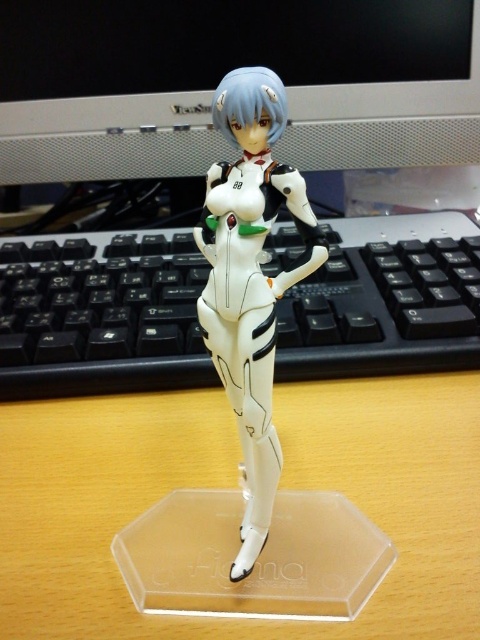
Find the location of a particular element. This screenshot has height=640, width=480. black plastic keyboard at center is located at coordinates (100, 314).

At what (x,y) coordinates should I click in order to perform the action: click on black plastic keyboard at center. Please return your answer as a coordinate pair (x, y). Image resolution: width=480 pixels, height=640 pixels. Looking at the image, I should click on (100, 314).

Is black plastic keyboard at center to the left of matte black monitor at upper center from the viewer's perspective?

Incorrect, black plastic keyboard at center is not on the left side of matte black monitor at upper center.

Which is in front, point (451, 250) or point (403, 161)?

Point (451, 250) is in front.

What do you see at coordinates (100, 314) in the screenshot? This screenshot has height=640, width=480. I see `black plastic keyboard at center` at bounding box center [100, 314].

I want to click on black plastic keyboard at center, so click(100, 314).

Can you confirm if clear wood table at center is taller than matte black monitor at upper center?

In fact, clear wood table at center may be shorter than matte black monitor at upper center.

Is clear wood table at center positioned before matte black monitor at upper center?

Yes, clear wood table at center is in front of matte black monitor at upper center.

Identify the location of clear wood table at center. The image size is (480, 640). (232, 486).